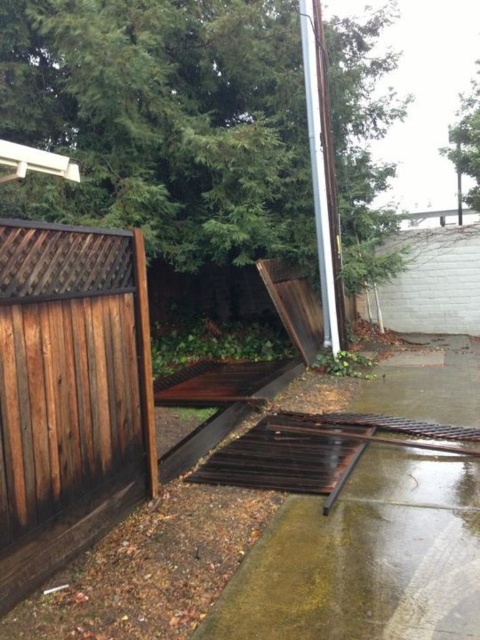
From the picture: You are a city inspector assessing damage after a storm. You need to locate the brown wooden fence at left in the image for your report. What are the coordinates of its position?

The brown wooden fence at left is located at coordinates (70, 394).

You are a construction worker assessing the damage after a storm. You notice the brown wooden fence at left and the silver metallic pole at upper right. Which object is taller?

The silver metallic pole at upper right is taller than the brown wooden fence at left.

You are a contractor assessing damage after a storm. You see the brown wooden fence at left and the silver metallic pole at upper right. Which object is positioned higher up in the image?

The silver metallic pole at upper right is positioned higher up in the image than the brown wooden fence at left.